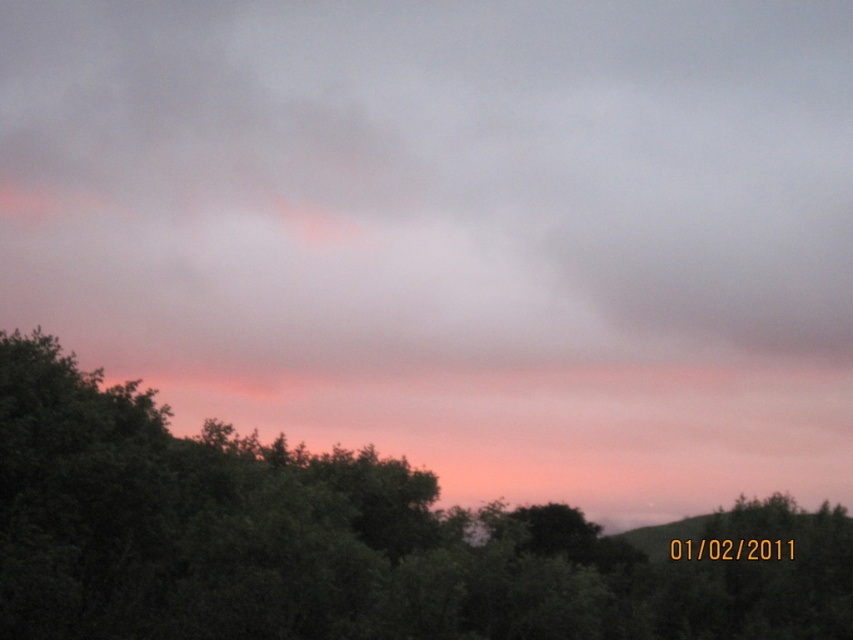
Question: Among these points, which one is farthest from the camera?

Choices:
 (A) (642, 163)
 (B) (685, 572)

Answer: (A)

Question: Is pink translucent cloud at upper center above green leafy tree at lower left?

Choices:
 (A) no
 (B) yes

Answer: (B)

Question: Among these objects, which one is nearest to the camera?

Choices:
 (A) green leafy tree at lower left
 (B) pink translucent cloud at upper center

Answer: (A)

Question: Can you confirm if pink translucent cloud at upper center is wider than green leafy tree at lower left?

Choices:
 (A) no
 (B) yes

Answer: (B)

Question: Where is pink translucent cloud at upper center located in relation to green leafy tree at lower left in the image?

Choices:
 (A) above
 (B) below

Answer: (A)